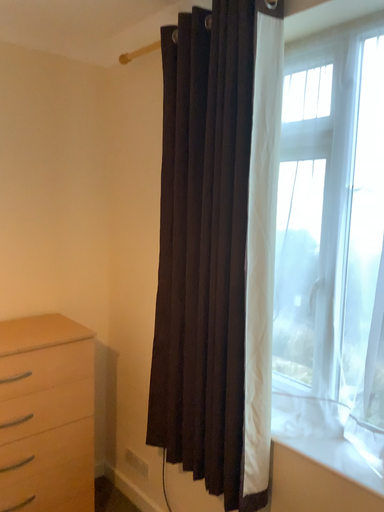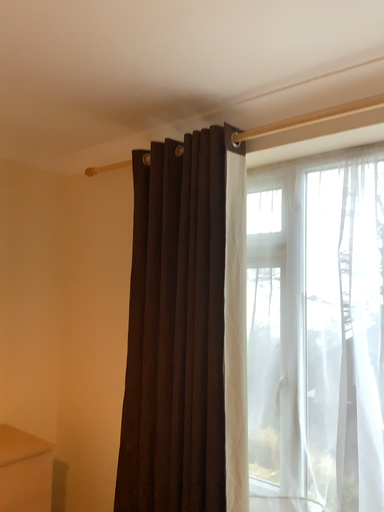
Question: How did the camera likely rotate when shooting the video?

Choices:
 (A) rotated upward
 (B) rotated downward

Answer: (A)